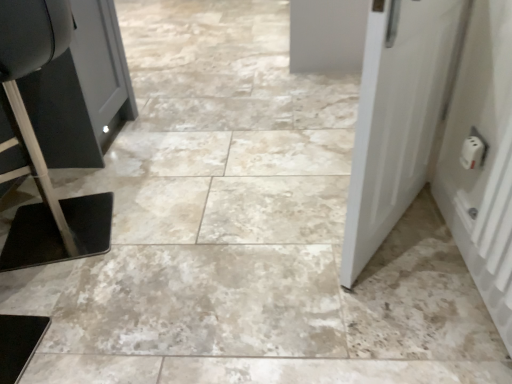
Find the location of a particular element. vacant region under white matte door at right, positioned as the 2th door in right-to-left order (from a real-world perspective) is located at coordinates (392, 235).